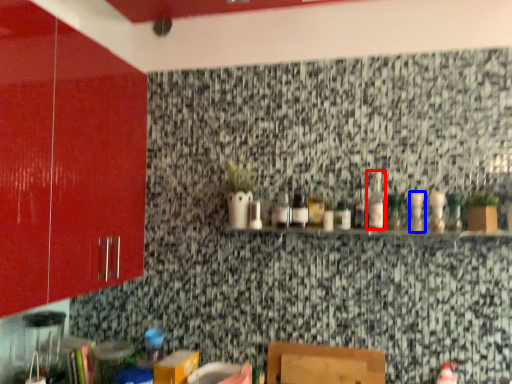
Question: Which object appears closest to the camera in this image, bottle (highlighted by a red box) or bottle (highlighted by a blue box)?

Choices:
 (A) bottle
 (B) bottle

Answer: (B)